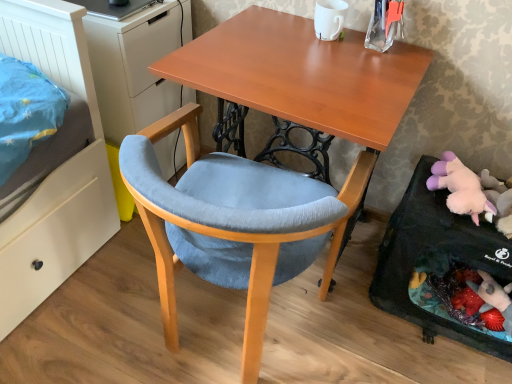
Question: Is fluffy pink plush at lower right bigger or smaller than matte white dresser at left?

Choices:
 (A) big
 (B) small

Answer: (B)

Question: Does point (428, 178) appear closer or farther from the camera than point (142, 18)?

Choices:
 (A) farther
 (B) closer

Answer: (B)

Question: Which is nearer to the wooden desk at center?

Choices:
 (A) velvet blue chair at center
 (B) fluffy pink stuffed animal at lower right
 (C) fluffy pink plush at lower right
 (D) matte white dresser at left

Answer: (A)

Question: Which of these objects is positioned farthest from the wooden desk at center?

Choices:
 (A) matte white dresser at left
 (B) fluffy pink plush at lower right
 (C) velvet blue chair at center
 (D) fluffy pink stuffed animal at lower right

Answer: (D)